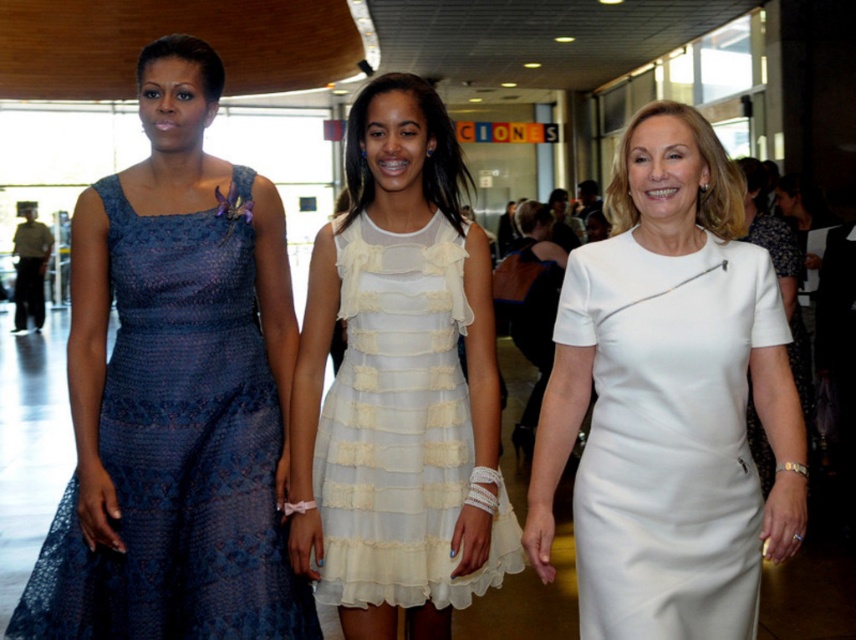
Between point (742, 298) and point (357, 248), which one is positioned in front?

Point (742, 298) is more forward.

Between point (663, 529) and point (403, 268), which one is positioned behind?

Positioned behind is point (403, 268).

Which is in front, point (639, 481) or point (435, 420)?

Point (639, 481)

I want to click on white smooth dress at center, so click(669, 400).

Which is above, white chiffon dress at center or white satin dress at center?

white satin dress at center is higher up.

Is white chiffon dress at center to the right of white satin dress at center from the viewer's perspective?

No, white chiffon dress at center is not to the right of white satin dress at center.

Is point (383, 336) positioned behind point (764, 182)?

That is False.

At what (x,y) coordinates should I click in order to perform the action: click on white chiffon dress at center. Please return your answer as a coordinate pair (x, y). Image resolution: width=856 pixels, height=640 pixels. Looking at the image, I should click on 402,428.

Between white smooth dress at center and lace dress at left, which one appears on the right side from the viewer's perspective?

white smooth dress at center is more to the right.

Does white smooth dress at center appear on the right side of lace dress at left?

Correct, you'll find white smooth dress at center to the right of lace dress at left.

This screenshot has width=856, height=640. What are the coordinates of `white smooth dress at center` in the screenshot? It's located at (669, 400).

Identify the location of white smooth dress at center. (669, 400).